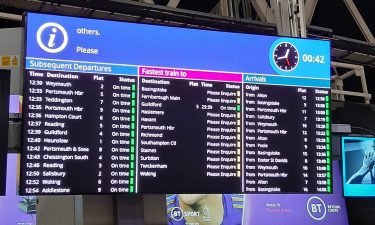
Locate an element on the screen. The image size is (375, 225). clock is located at coordinates (285, 56).